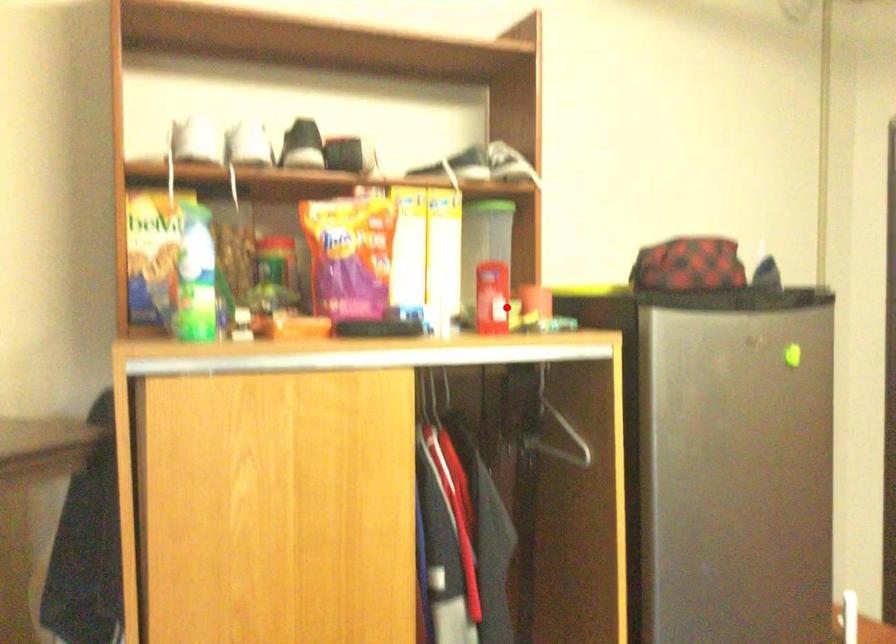
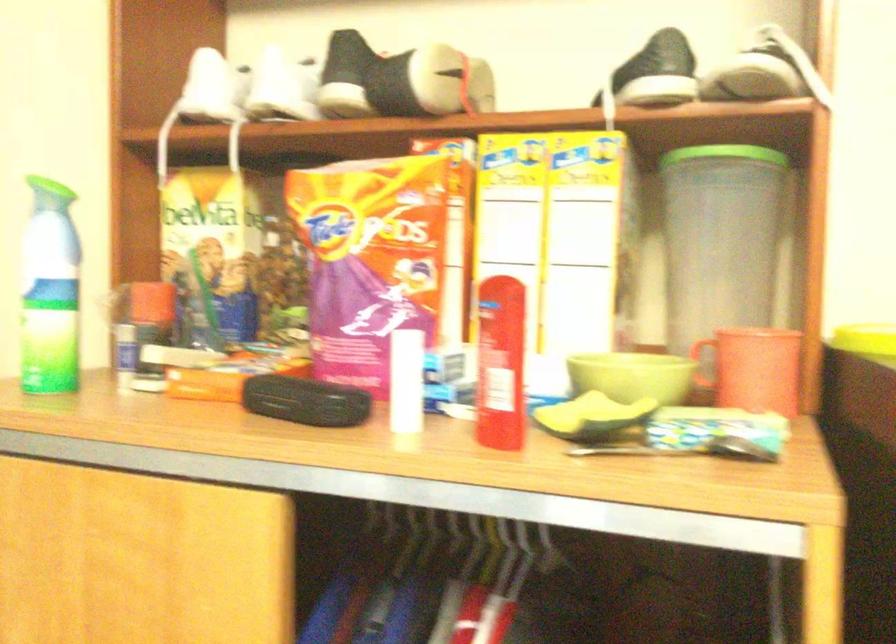
Question: I am providing you with two images of the same scene from different viewpoints. Given a red point in image1, look at the same physical point in image2. Is it:

Choices:
 (A) Closer to the viewpoint
 (B) Farther from the viewpoint

Answer: (A)